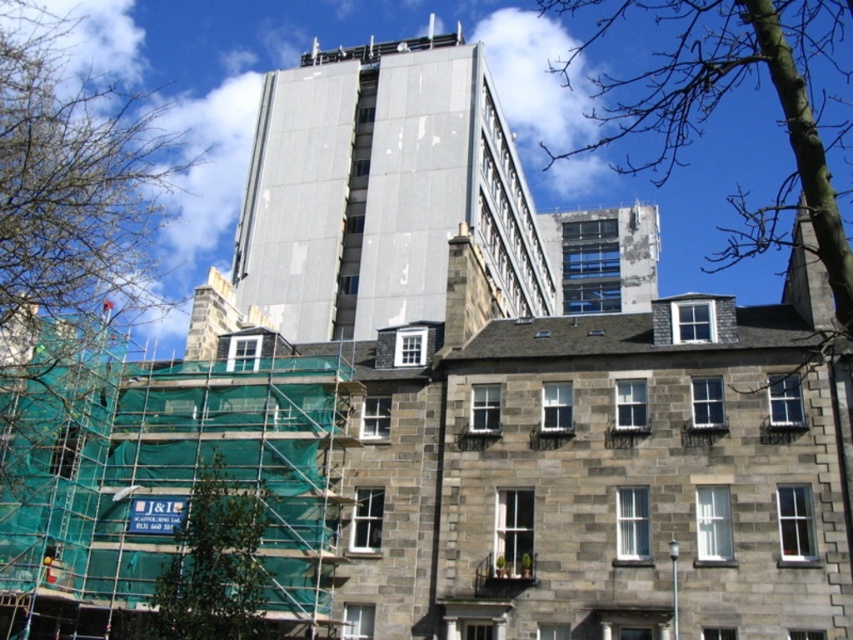
Question: Does bare wood tree at upper right appear under green leafy tree at lower left?

Choices:
 (A) yes
 (B) no

Answer: (B)

Question: Considering the real-world distances, which object is closest to the bare wood tree at upper right?

Choices:
 (A) green leafy tree at left
 (B) green leafy tree at lower left

Answer: (B)

Question: Among these objects, which one is farthest from the camera?

Choices:
 (A) green leafy tree at left
 (B) green leafy tree at lower left
 (C) silver metallic building at center

Answer: (C)

Question: Among these points, which one is nearest to the camera?

Choices:
 (A) (57, 288)
 (B) (236, 637)

Answer: (B)

Question: Is green leafy tree at left behind green leafy tree at lower left?

Choices:
 (A) yes
 (B) no

Answer: (A)

Question: Is green leafy tree at left below bare wood tree at upper right?

Choices:
 (A) no
 (B) yes

Answer: (B)